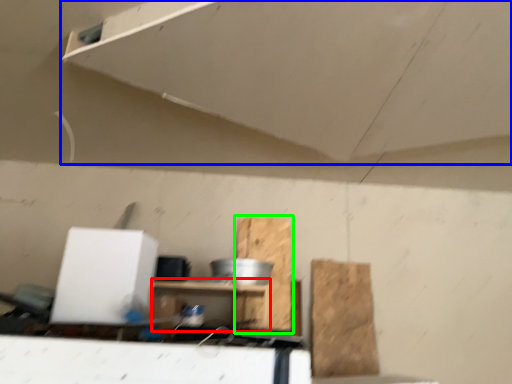
Question: Which object is the farthest from furniture (highlighted by a red box)? Choose among these: exhaust hood (highlighted by a blue box) or cardboard (highlighted by a green box).

Choices:
 (A) exhaust hood
 (B) cardboard

Answer: (A)